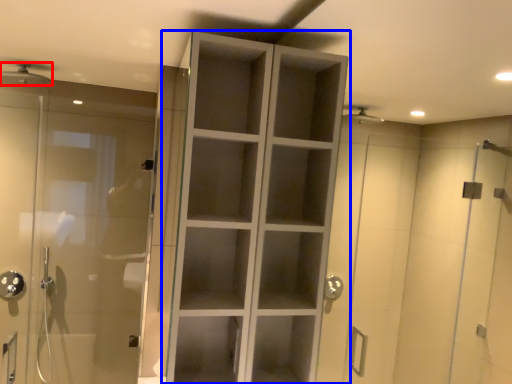
Question: Among these objects, which one is farthest to the camera, shower (highlighted by a red box) or cupboard (highlighted by a blue box)?

Choices:
 (A) shower
 (B) cupboard

Answer: (A)